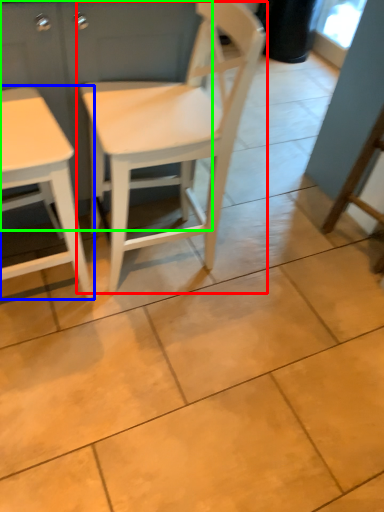
Question: Estimate the real-world distances between objects in this image. Which object is closer to chair (highlighted by a red box), table (highlighted by a blue box) or dresser (highlighted by a green box)?

Choices:
 (A) table
 (B) dresser

Answer: (B)